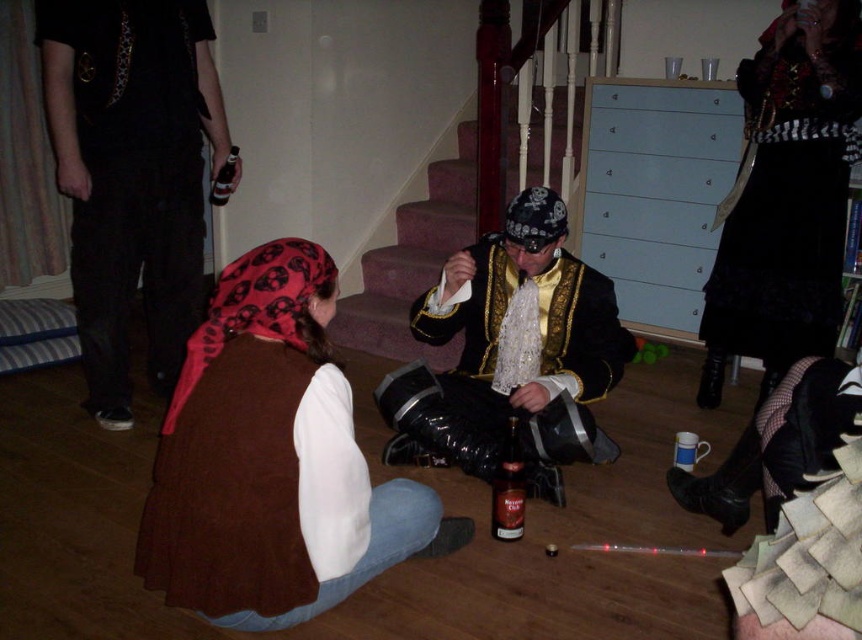
Between point (236, 340) and point (167, 284), which one is positioned behind?

Point (167, 284)

Which is below, brown fabric vest at lower left or black cotton pants at upper left?

brown fabric vest at lower left

Which is in front, point (392, 516) or point (166, 305)?

Point (392, 516) is more forward.

Locate an element on the screen. brown fabric vest at lower left is located at coordinates (272, 460).

Which is below, brown fabric vest at lower left or gold embroidered jacket at center?

brown fabric vest at lower left

Is brown fabric vest at lower left further to the viewer compared to gold embroidered jacket at center?

No.

What do you see at coordinates (272, 460) in the screenshot?
I see `brown fabric vest at lower left` at bounding box center [272, 460].

Find the location of a particular element. Image resolution: width=862 pixels, height=640 pixels. brown fabric vest at lower left is located at coordinates (272, 460).

Does black lace skirt at lower right have a lesser height compared to gold embroidered jacket at center?

In fact, black lace skirt at lower right may be taller than gold embroidered jacket at center.

Is black lace skirt at lower right to the right of gold embroidered jacket at center from the viewer's perspective?

Correct, you'll find black lace skirt at lower right to the right of gold embroidered jacket at center.

This screenshot has width=862, height=640. What do you see at coordinates (790, 189) in the screenshot? I see `black lace skirt at lower right` at bounding box center [790, 189].

Locate an element on the screen. The height and width of the screenshot is (640, 862). black lace skirt at lower right is located at coordinates (790, 189).